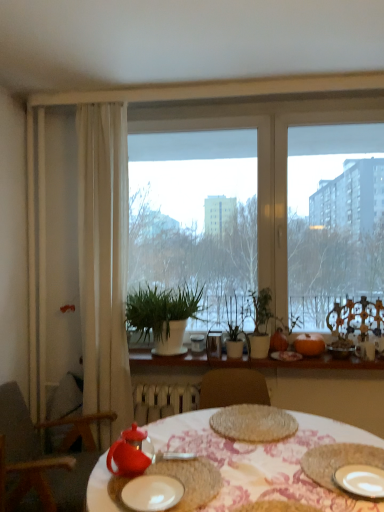
Find the location of `free space to the back side of matte red teapot at lower center, placed as the 1th tableware when sorted from left to right`. free space to the back side of matte red teapot at lower center, placed as the 1th tableware when sorted from left to right is located at coordinates (163, 448).